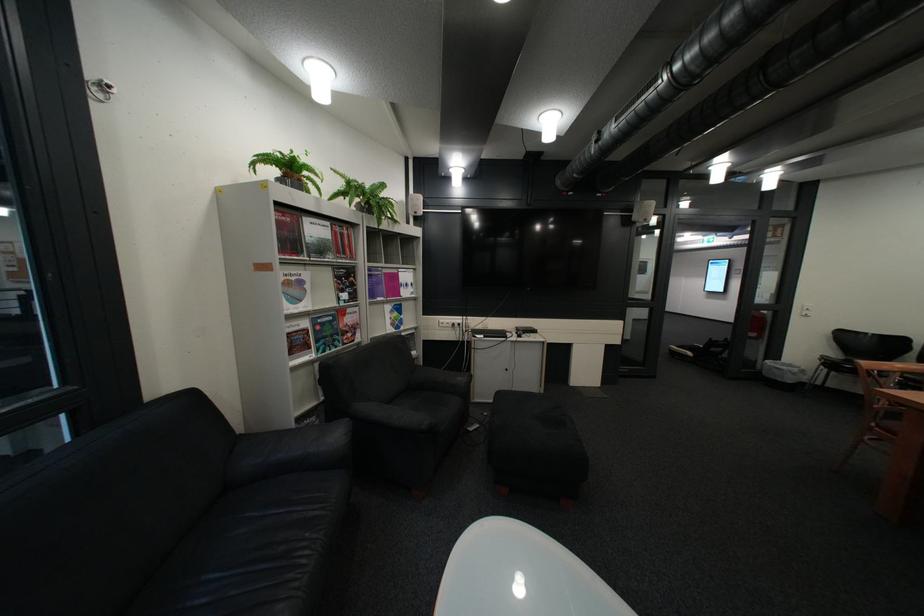
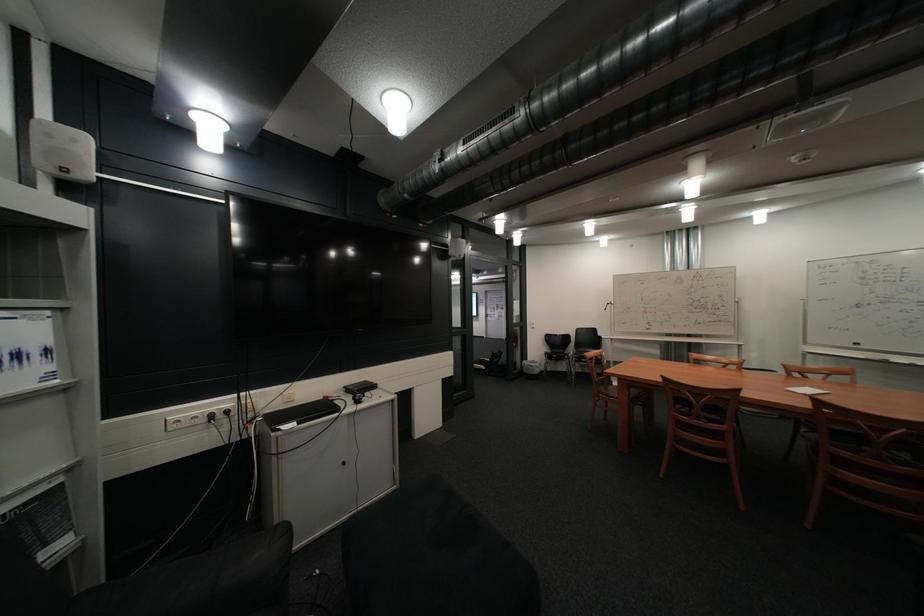
Where in the second image is the point corresponding to the point at 781,360 from the first image?

(537, 361)